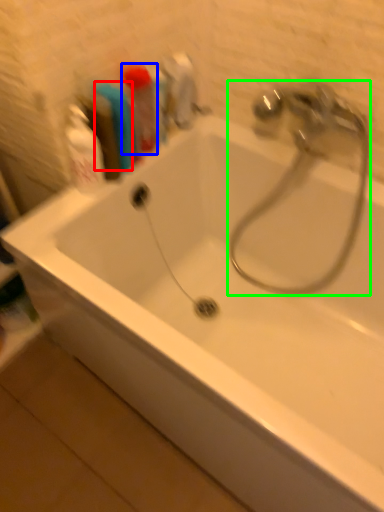
Question: Which object is the farthest from toiletry (highlighted by a red box)? Choose among these: toiletry (highlighted by a blue box) or tap (highlighted by a green box).

Choices:
 (A) toiletry
 (B) tap

Answer: (B)